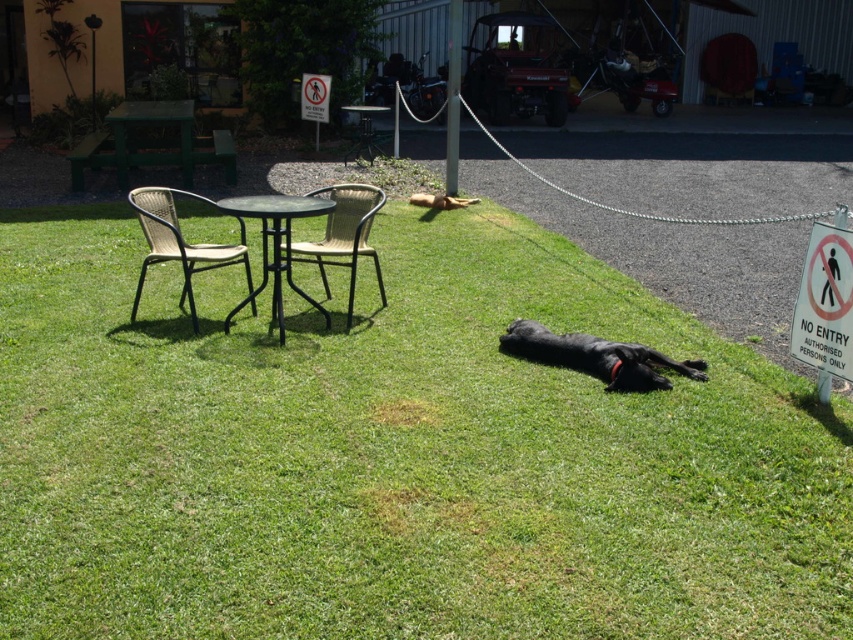
From the picture: You are planning to place a small potted plant between the woven rattan chair at left and the black dog on the right. Given their positions, where should you place the plant to ensure it is equidistant from both objects?

The woven rattan chair at left is located at point [180,241]. To place the plant equidistant from both objects, calculate the midpoint between these coordinates. The midpoint would be at approximately [180,241] and the dog position, but since the dog is on the right, the exact coordinates depend on the dog position. However, without the dog coordinates, the answer can only reference the chair position.

You are a gardener who needs to water the green grass at center. You have a garden hose that can reach 3 meters. The black metal table at center is in the way. Can you water the grass without moving the table?

The distance between the green grass at center and the black metal table at center is 3.05 meters. Since the hose can only reach 3 meters, you cannot water the grass without moving the table.

You are planning to set up a small garden on the green grass at center. Considering the height of the black metal table at center, will the grass interfere with the table visibility once it grows?

The green grass at center is not as tall as the black metal table at center, so even if the grass grows, it won not interfere with the table visibility.